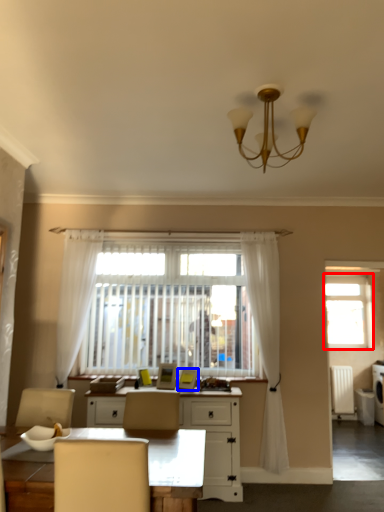
Question: Which point is further to the camera, window (highlighted by a red box) or picture frame (highlighted by a blue box)?

Choices:
 (A) window
 (B) picture frame

Answer: (A)